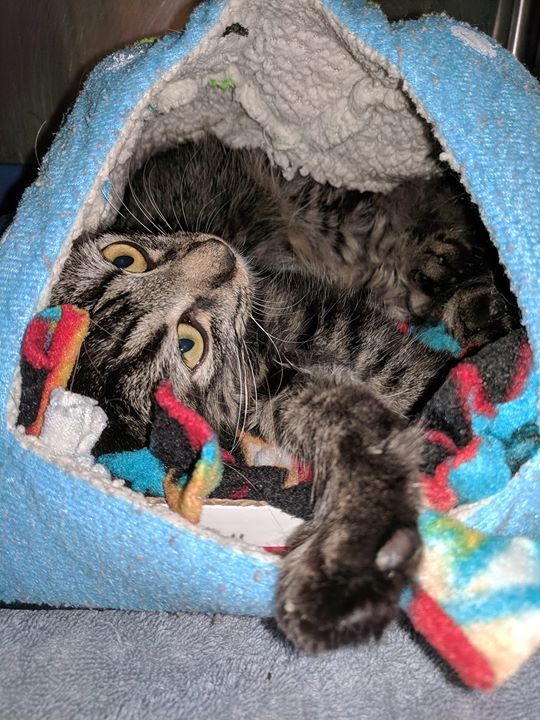
Where is `wall`? The width and height of the screenshot is (540, 720). wall is located at coordinates (54, 37).